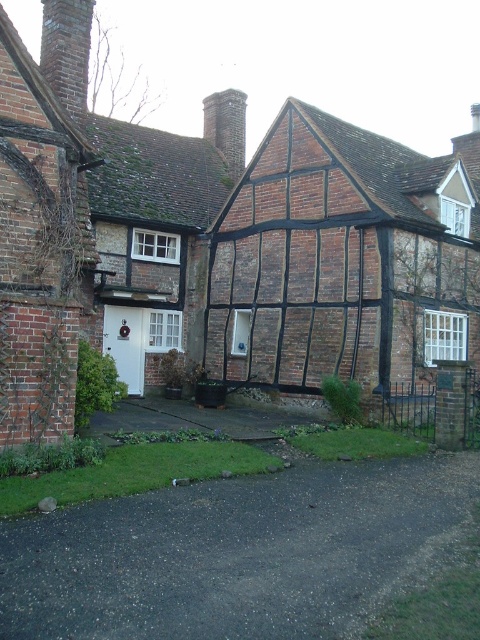
Looking at this image, you are a delivery person approaching the house and need to park your vehicle. You see the dark gray asphalt driveway at lower center and the brick chimney at upper left. Which direction should you turn to reach the driveway from the chimney?

You should turn to the right to reach the dark gray asphalt driveway at lower center from the brick chimney at upper left since the driveway is positioned to the right of the chimney.

You are a delivery person approaching the house and need to park your van on the driveway. The van requires a driveway at least 3 meters wide. Can you park on the dark asphalt driveway at lower center or the dark gray asphalt driveway at lower center?

The dark asphalt driveway at lower center has a greater width than the dark gray asphalt driveway at lower center. If the dark asphalt driveway at lower center is wider than 3 meters, then parking there is possible. However, without specific width measurements, it is uncertain whether either driveway meets the 3 meter requirement.